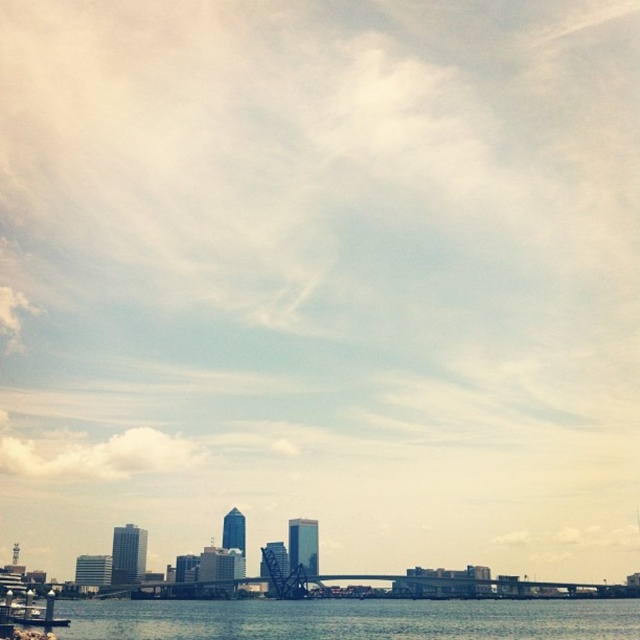
Which is in front, point (241, 627) or point (52, 627)?

Point (52, 627) is in front.

Who is more distant from viewer, (588,628) or (28,616)?

Positioned behind is point (588,628).

Where is `clear water at lower center`? This screenshot has width=640, height=640. clear water at lower center is located at coordinates (352, 620).